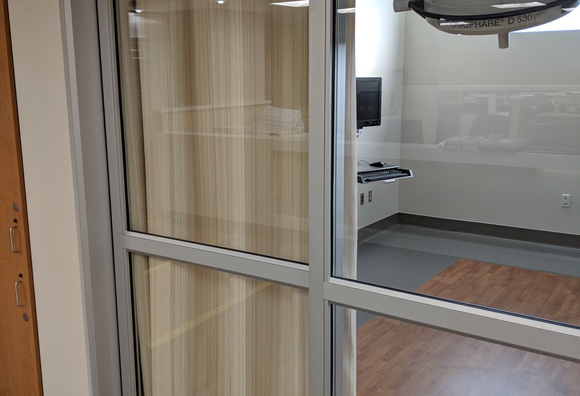
This screenshot has height=396, width=580. Identify the location of computer keyboard. (387, 172).